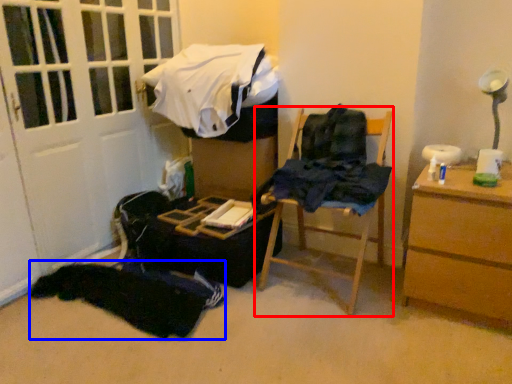
Question: Which object is further to the camera taking this photo, furniture (highlighted by a red box) or clothing (highlighted by a blue box)?

Choices:
 (A) furniture
 (B) clothing

Answer: (B)